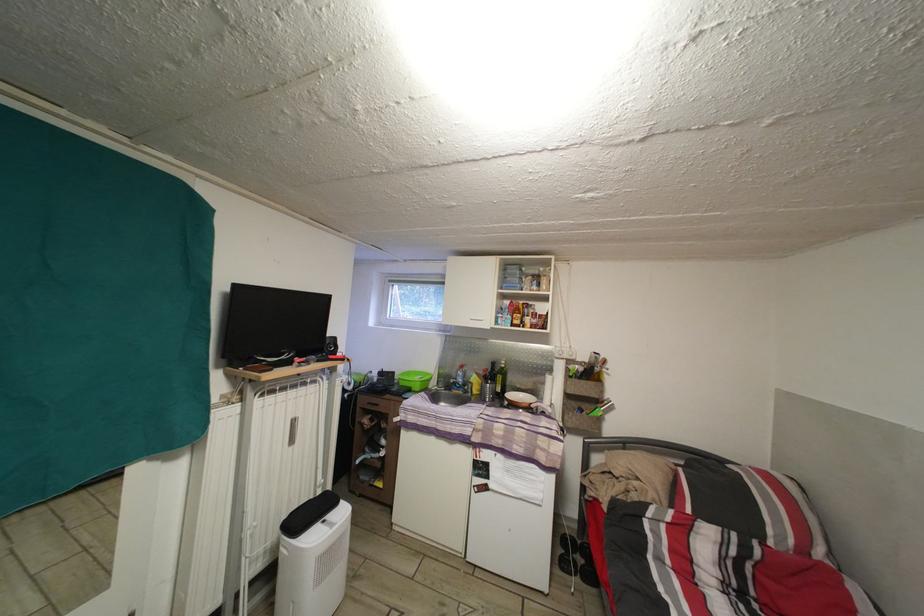
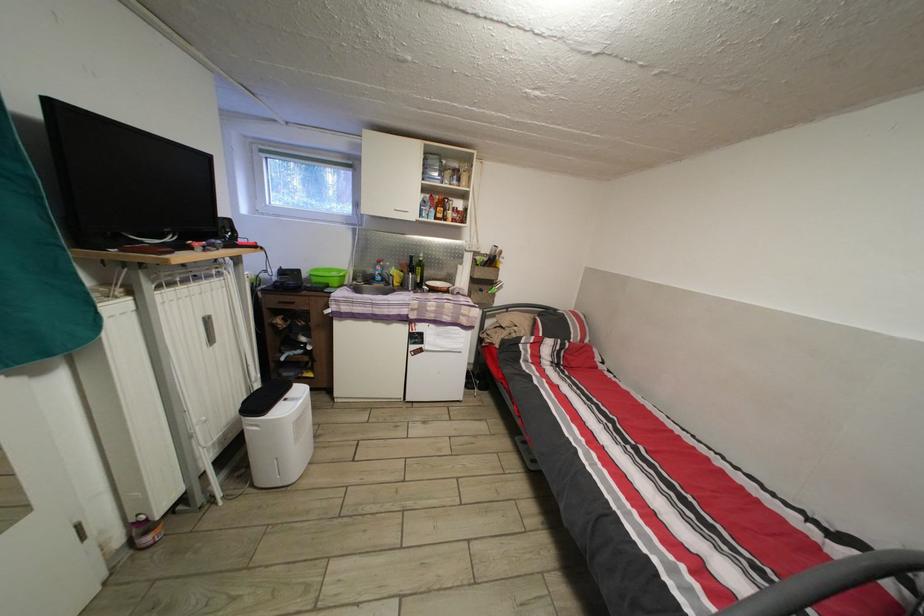
Find the pixel in the second image that matches [404,384] in the first image.

(311, 282)